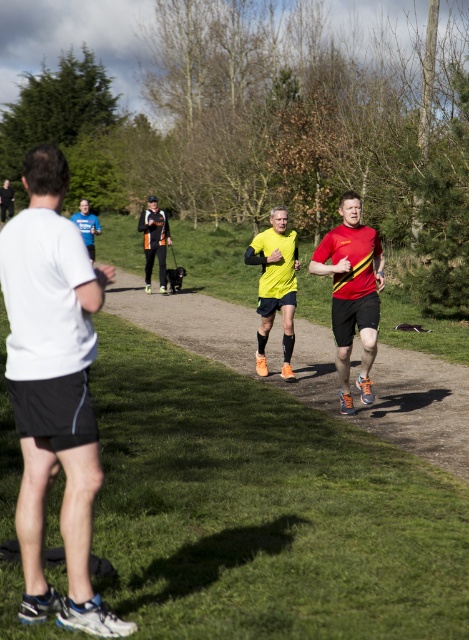
Which is more to the left, white matte shirt at left or dirt path at center?

From the viewer's perspective, white matte shirt at left appears more on the left side.

In the scene shown: Does white matte shirt at left appear on the right side of dirt path at center?

Incorrect, white matte shirt at left is not on the right side of dirt path at center.

Does point (45, 376) come behind point (358, 404)?

No, it is in front of (358, 404).

Find the location of `white matte shirt at left`. white matte shirt at left is located at coordinates click(x=53, y=388).

Who is more forward, (82, 435) or (379, 260)?

Positioned in front is point (82, 435).

This screenshot has height=640, width=469. Identify the location of white matte shirt at left. tap(53, 388).

The image size is (469, 640). Describe the element at coordinates (53, 388) in the screenshot. I see `white matte shirt at left` at that location.

Locate an element on the screen. Image resolution: width=469 pixels, height=640 pixels. white matte shirt at left is located at coordinates (53, 388).

Is red/yellow striped shirt at center closer to camera compared to yellow matte running shoe at center?

Yes, red/yellow striped shirt at center is in front of yellow matte running shoe at center.

Which is above, red/yellow striped shirt at center or yellow matte running shoe at center?

yellow matte running shoe at center is above.

Who is more forward, (349,342) or (290,310)?

Positioned in front is point (349,342).

Where is `red/yellow striped shirt at center`? Image resolution: width=469 pixels, height=640 pixels. red/yellow striped shirt at center is located at coordinates (352, 291).